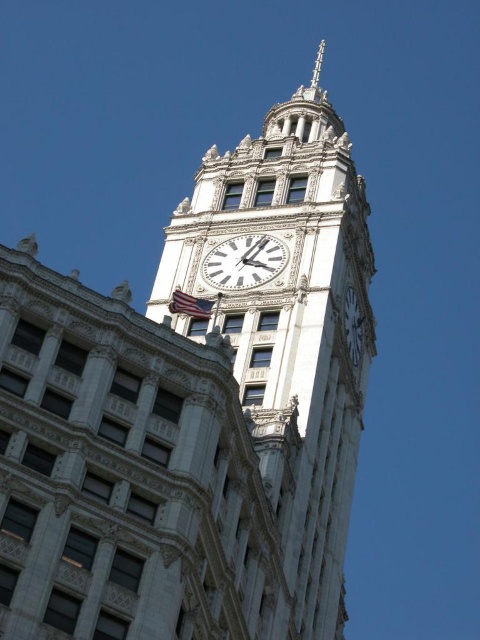
You are a photographer standing in front of the Wrigley Building clock tower. You want to take a photo that includes both the white glossy clock at center and the polished silver spire at upper center. Which object will appear taller in your photo?

The polished silver spire at upper center will appear taller in the photo because it is taller than the white glossy clock at center according to the description.

You are standing at the base of the Wrigley Building clock tower and want to take a photo of the white glossy clock at center. To ensure the clock is centered in your photo, where should you position yourself relative to the clock?

The white glossy clock at center is located at point (243, 260), so you should position yourself directly in front of the clock to ensure it is centered in your photo.